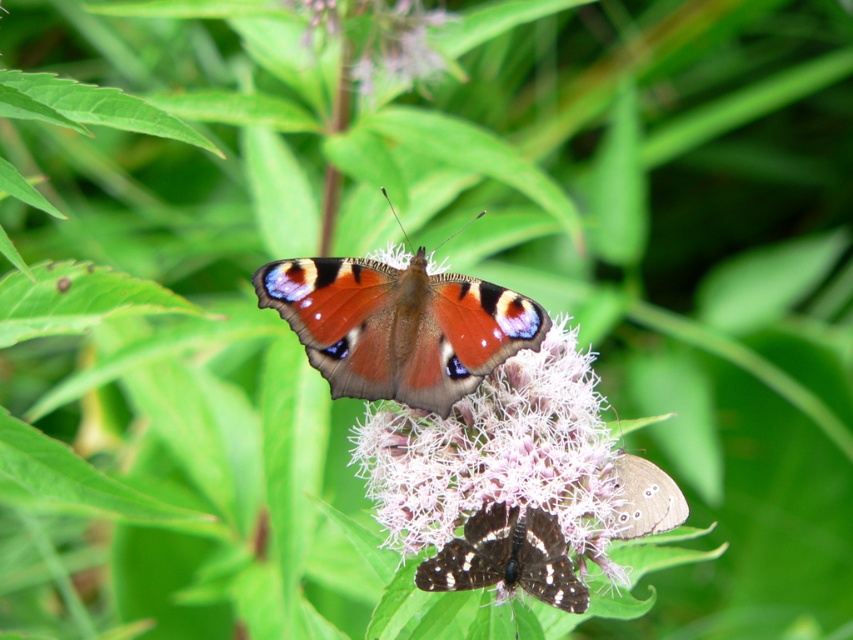
You are a photographer trying to capture a closeup shot of the shiny brown butterfly at center. There is a pink fluffy flower at center blocking your view. Can you determine which object is more to the left and needs to be moved first?

The pink fluffy flower at center is positioned on the left side of the shiny brown butterfly at center, so it needs to be moved first to get a clear view of the butterfly.